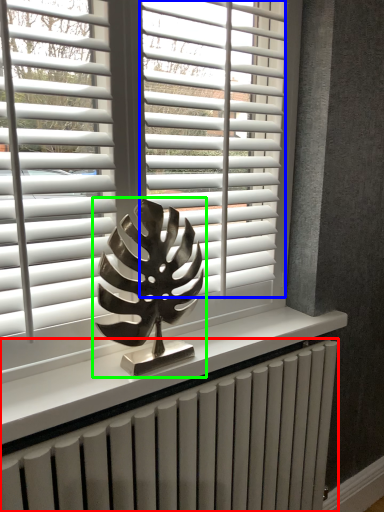
Question: Based on their relative distances, which object is farther from radiator (highlighted by a red box)? Choose from blind (highlighted by a blue box) and sculpture (highlighted by a green box).

Choices:
 (A) blind
 (B) sculpture

Answer: (A)